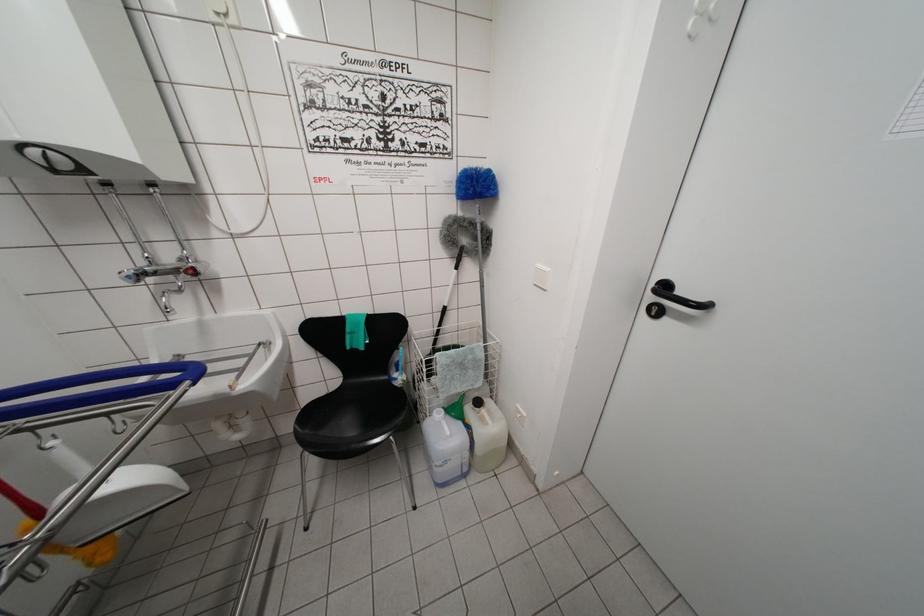
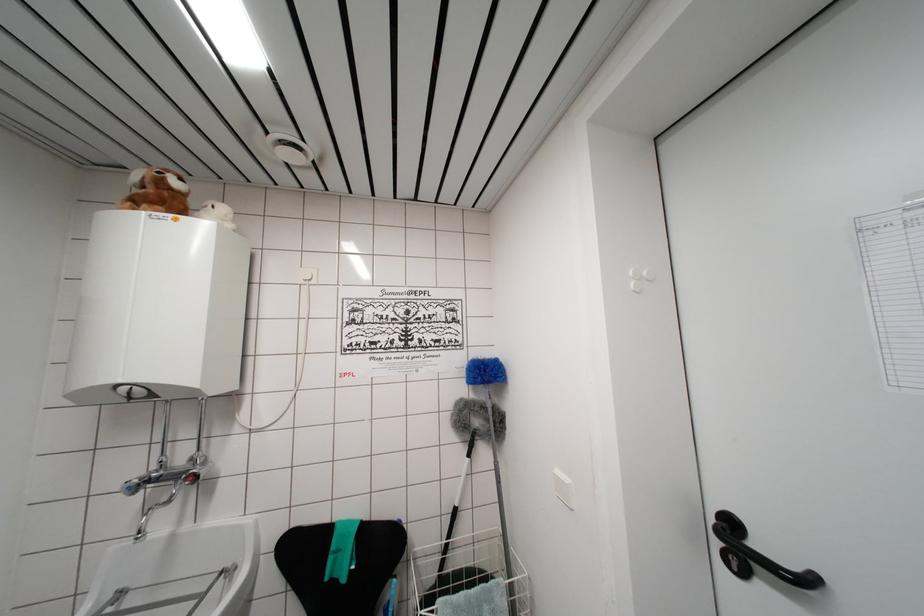
The point at (193, 270) is marked in the first image. Where is the corresponding point in the second image?

(197, 476)